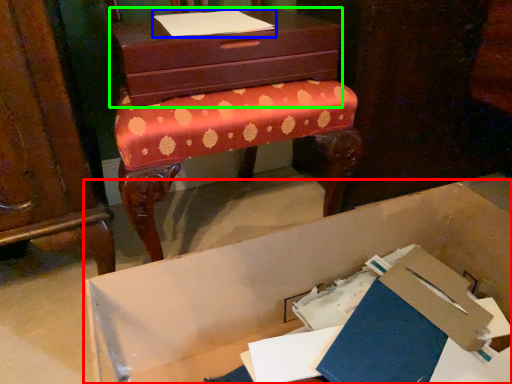
Question: Which is nearer to the cardboard box (highlighted by a red box)? notebook (highlighted by a blue box) or chest of drawers (highlighted by a green box).

Choices:
 (A) notebook
 (B) chest of drawers

Answer: (B)